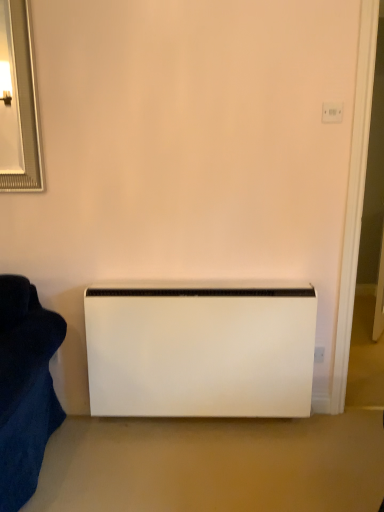
Question: Looking at their shapes, would you say white plastic electric outlet at upper right is wider or thinner than white matte heater at center?

Choices:
 (A) wide
 (B) thin

Answer: (B)

Question: Is white plastic electric outlet at upper right spatially inside white matte heater at center, or outside of it?

Choices:
 (A) inside
 (B) outside

Answer: (B)

Question: Does point (334, 121) appear closer or farther from the camera than point (185, 332)?

Choices:
 (A) closer
 (B) farther

Answer: (A)

Question: Considering the relative positions of white matte heater at center and white plastic electric outlet at upper right in the image provided, is white matte heater at center to the left or to the right of white plastic electric outlet at upper right?

Choices:
 (A) left
 (B) right

Answer: (A)

Question: Considering the positions of white matte heater at center and white plastic electric outlet at upper right in the image, is white matte heater at center wider or thinner than white plastic electric outlet at upper right?

Choices:
 (A) wide
 (B) thin

Answer: (A)

Question: Looking at the image, does white matte heater at center seem bigger or smaller compared to white plastic electric outlet at upper right?

Choices:
 (A) small
 (B) big

Answer: (B)

Question: From their relative heights in the image, would you say white matte heater at center is taller or shorter than white plastic electric outlet at upper right?

Choices:
 (A) short
 (B) tall

Answer: (B)